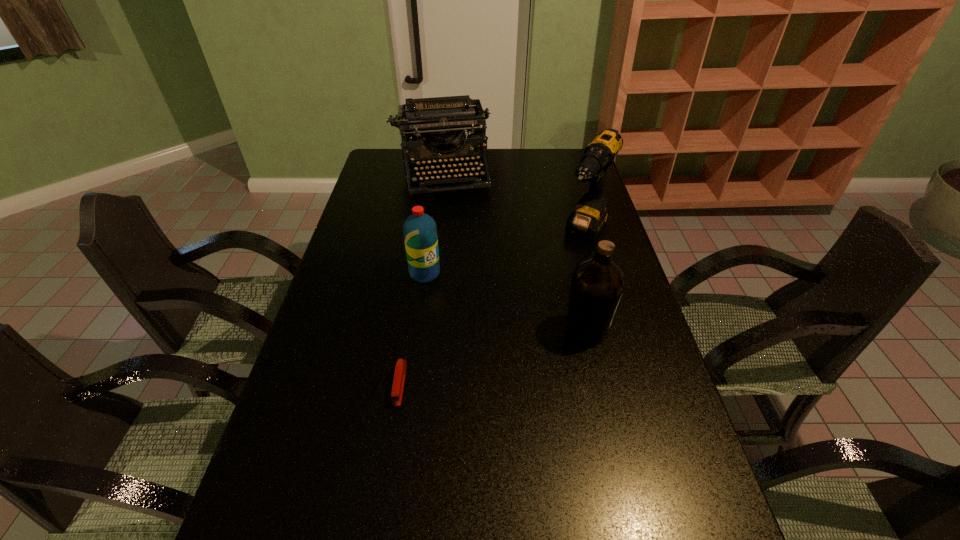
Locate an element on the screen. The width and height of the screenshot is (960, 540). drill that is at the right edge is located at coordinates (585, 222).

Where is `object positioned at the far left corner`? This screenshot has height=540, width=960. object positioned at the far left corner is located at coordinates coord(429,121).

Where is `vacant region at the near edge of the desktop`? vacant region at the near edge of the desktop is located at coordinates (355, 521).

In the image, there is a desktop. Identify the location of vacant space at the left edge. The width and height of the screenshot is (960, 540). (321, 360).

Where is `free space between the second nearest object and the typewriter`? free space between the second nearest object and the typewriter is located at coordinates (514, 253).

Locate an element on the screen. The width and height of the screenshot is (960, 540). vacant area that lies between the nearest object and the second nearest object is located at coordinates (x=493, y=357).

Image resolution: width=960 pixels, height=540 pixels. Identify the location of vacant area between the third farthest object and the fourth farthest object. (505, 302).

Where is `free space between the second farthest object and the nearest object`? free space between the second farthest object and the nearest object is located at coordinates (492, 309).

The image size is (960, 540). What are the coordinates of `free spot between the drill and the farthest object` in the screenshot? It's located at (513, 204).

You are a GUI agent. You are given a task and a screenshot of the screen. Output one action in this format:
    pyautogui.click(x=<x>, y=<y>)
    Task: Click on the vacant point located between the nearest object and the drill
    Image resolution: width=960 pixels, height=540 pixels.
    Given the screenshot: What is the action you would take?
    (x=492, y=309)